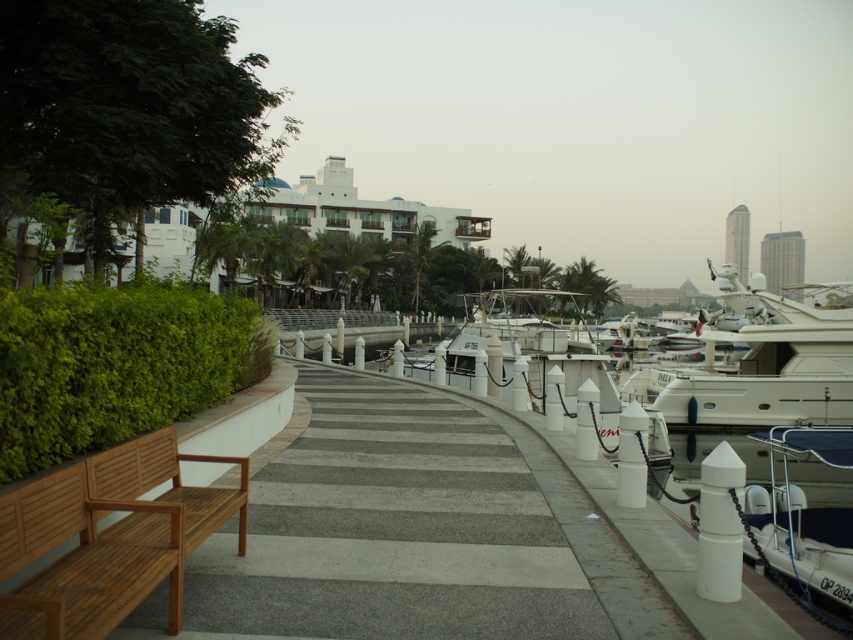
Question: Considering the relative positions of white glossy boat at right and white glossy boat at lower right in the image provided, where is white glossy boat at right located with respect to white glossy boat at lower right?

Choices:
 (A) above
 (B) below

Answer: (A)

Question: Which object is positioned farthest from the white glossy boat at right?

Choices:
 (A) white glossy boat at lower right
 (B) teak wood bench at lower left
 (C) white glossy boat at center

Answer: (B)

Question: Does white glossy boat at right appear under white glossy boat at center?

Choices:
 (A) yes
 (B) no

Answer: (A)

Question: Can you confirm if white glossy boat at right is smaller than white glossy boat at center?

Choices:
 (A) no
 (B) yes

Answer: (B)

Question: Which point is closer to the camera?

Choices:
 (A) teak wood bench at lower left
 (B) white glossy boat at lower right

Answer: (A)

Question: Which object is the closest to the white glossy boat at lower right?

Choices:
 (A) white glossy boat at center
 (B) white glossy boat at right

Answer: (B)